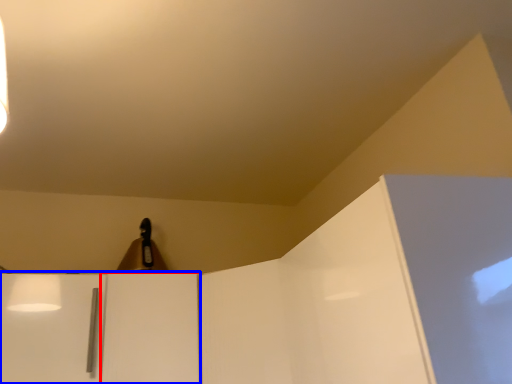
Question: Among these objects, which one is farthest to the camera, door (highlighted by a red box) or cabinetry (highlighted by a blue box)?

Choices:
 (A) door
 (B) cabinetry

Answer: (A)